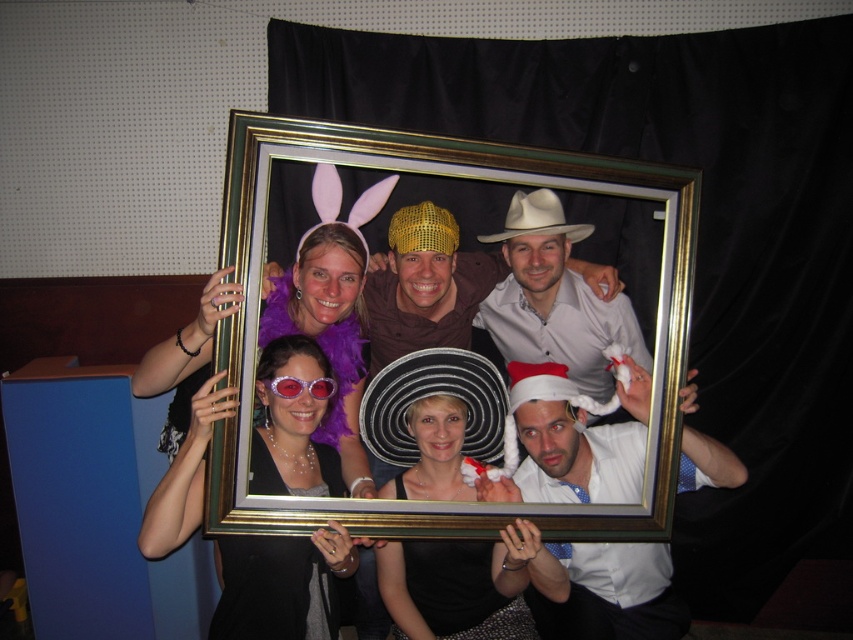
Question: Which object is the closest to the white matte cowboy hat at upper center?

Choices:
 (A) purple shiny goggles at center
 (B) black felt cowboy hat at center
 (C) black satin dress at center
 (D) black sequined dress at center

Answer: (B)

Question: Estimate the real-world distances between objects in this image. Which object is farther from the black sequined dress at center?

Choices:
 (A) white matte cowboy hat at upper center
 (B) gold metallic picture frame at center
 (C) black felt cowboy hat at center
 (D) white satin santa hat at lower right

Answer: (A)

Question: Can you confirm if black satin dress at center is positioned to the right of black felt cowboy hat at center?

Choices:
 (A) no
 (B) yes

Answer: (A)

Question: Does gold metallic picture frame at center have a smaller size compared to white matte cowboy hat at upper center?

Choices:
 (A) no
 (B) yes

Answer: (A)

Question: Can you confirm if black felt cowboy hat at center is positioned to the right of white matte cowboy hat at upper center?

Choices:
 (A) no
 (B) yes

Answer: (A)

Question: Which is nearer to the black satin hat at center?

Choices:
 (A) purple shiny goggles at center
 (B) matte purple dress at center
 (C) black felt cowboy hat at center

Answer: (C)